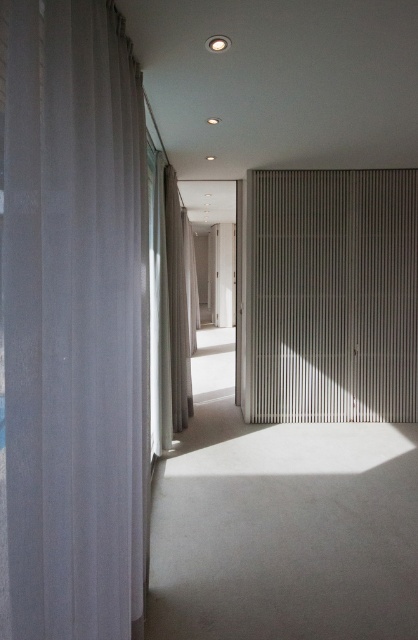
You are designing a window treatment for a minimalist hallway and have two sheer white curtains available. The first is labeled as the sheer white curtain at left, and the second is the white sheer curtain at left. Which curtain would you choose if you want the wider one to cover the window more effectively?

The white sheer curtain at left is wider than the sheer white curtain at left, so choosing the white sheer curtain at left would be better to cover the window more effectively.